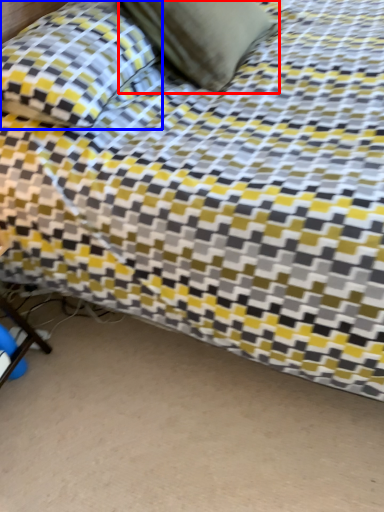
Question: Which of the following is the farthest to the observer, pillow (highlighted by a red box) or pillow (highlighted by a blue box)?

Choices:
 (A) pillow
 (B) pillow

Answer: (A)